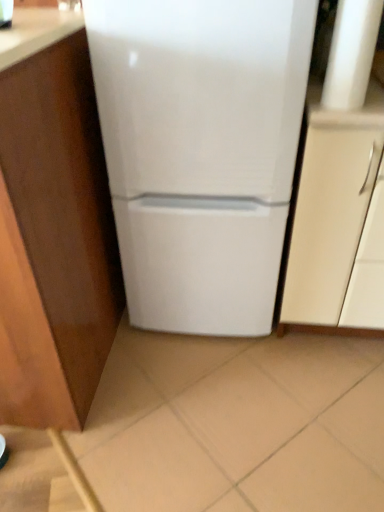
What is the approximate height of matte white cabinet at right, which appears as the 2th cabinetry when viewed from the left?

matte white cabinet at right, which appears as the 2th cabinetry when viewed from the left, is 33.49 inches in height.

At what (x,y) coordinates should I click in order to perform the action: click on white glossy refrigerator at center. Please return your answer as a coordinate pair (x, y). Looking at the image, I should click on (200, 152).

Identify the location of matte white cabinet at right, which appears as the 2th cabinetry when viewed from the left. (328, 212).

Which of these two, wooden cabinet at left, the first cabinetry viewed from the left, or matte white cabinet at right, positioned as the first cabinetry in right-to-left order, stands shorter?

matte white cabinet at right, positioned as the first cabinetry in right-to-left order, is shorter.

Considering the sizes of objects wooden cabinet at left, positioned as the second cabinetry in right-to-left order, and matte white cabinet at right, which appears as the 2th cabinetry when viewed from the left, in the image provided, who is thinner, wooden cabinet at left, positioned as the second cabinetry in right-to-left order, or matte white cabinet at right, which appears as the 2th cabinetry when viewed from the left,?

wooden cabinet at left, positioned as the second cabinetry in right-to-left order.

What's the angular difference between wooden cabinet at left, the first cabinetry viewed from the left, and matte white cabinet at right, positioned as the first cabinetry in right-to-left order,'s facing directions?

The angular difference between wooden cabinet at left, the first cabinetry viewed from the left, and matte white cabinet at right, positioned as the first cabinetry in right-to-left order, is 90 degrees.

From the image's perspective, which one is positioned lower, wooden cabinet at left, positioned as the second cabinetry in right-to-left order, or matte white cabinet at right, positioned as the first cabinetry in right-to-left order?

wooden cabinet at left, positioned as the second cabinetry in right-to-left order, is shown below in the image.

Which is nearer, (x=120, y=224) or (x=52, y=46)?

Point (x=120, y=224).

Is white glossy refrigerator at center oriented away from wooden cabinet at left, positioned as the second cabinetry in right-to-left order?

No, white glossy refrigerator at center's orientation is not away from wooden cabinet at left, positioned as the second cabinetry in right-to-left order.

Does white glossy refrigerator at center appear on the left side of wooden cabinet at left, the first cabinetry viewed from the left?

No.

Is white glossy refrigerator at center thinner than wooden cabinet at left, the first cabinetry viewed from the left?

Incorrect, the width of white glossy refrigerator at center is not less than that of wooden cabinet at left, the first cabinetry viewed from the left.

In the image, is white glossy refrigerator at center on the left side or the right side of matte white cabinet at right, which appears as the 2th cabinetry when viewed from the left?

Based on their positions, white glossy refrigerator at center is located to the left of matte white cabinet at right, which appears as the 2th cabinetry when viewed from the left.

Is white glossy refrigerator at center positioned far away from matte white cabinet at right, positioned as the first cabinetry in right-to-left order?

No, there isn't a large distance between white glossy refrigerator at center and matte white cabinet at right, positioned as the first cabinetry in right-to-left order.

Can you confirm if white glossy refrigerator at center is smaller than matte white cabinet at right, which appears as the 2th cabinetry when viewed from the left?

Indeed, white glossy refrigerator at center has a smaller size compared to matte white cabinet at right, which appears as the 2th cabinetry when viewed from the left.

Is white glossy refrigerator at center oriented towards matte white cabinet at right, which appears as the 2th cabinetry when viewed from the left?

No.

Is matte white cabinet at right, positioned as the first cabinetry in right-to-left order, bigger than white glossy refrigerator at center?

Correct, matte white cabinet at right, positioned as the first cabinetry in right-to-left order, is larger in size than white glossy refrigerator at center.

Does matte white cabinet at right, positioned as the first cabinetry in right-to-left order, appear on the left side of white glossy refrigerator at center?

Incorrect, matte white cabinet at right, positioned as the first cabinetry in right-to-left order, is not on the left side of white glossy refrigerator at center.

Considering the sizes of objects matte white cabinet at right, which appears as the 2th cabinetry when viewed from the left, and white glossy refrigerator at center in the image provided, who is shorter, matte white cabinet at right, which appears as the 2th cabinetry when viewed from the left, or white glossy refrigerator at center?

matte white cabinet at right, which appears as the 2th cabinetry when viewed from the left, is shorter.

From a real-world perspective, starting from the white glossy refrigerator at center, which cabinetry is the 1st one below it? Please provide its 2D coordinates.

[(54, 240)]

Can you tell me how much wooden cabinet at left, the first cabinetry viewed from the left, and white glossy refrigerator at center differ in facing direction?

There is a 90.7-degree angle between the facing directions of wooden cabinet at left, the first cabinetry viewed from the left, and white glossy refrigerator at center.

Are wooden cabinet at left, positioned as the second cabinetry in right-to-left order, and white glossy refrigerator at center located far from each other?

wooden cabinet at left, positioned as the second cabinetry in right-to-left order, is actually quite close to white glossy refrigerator at center.

In the image, is matte white cabinet at right, positioned as the first cabinetry in right-to-left order, on the left side or the right side of wooden cabinet at left, positioned as the second cabinetry in right-to-left order?

In the image, matte white cabinet at right, positioned as the first cabinetry in right-to-left order, appears on the right side of wooden cabinet at left, positioned as the second cabinetry in right-to-left order.

Considering the sizes of objects matte white cabinet at right, which appears as the 2th cabinetry when viewed from the left, and wooden cabinet at left, positioned as the second cabinetry in right-to-left order, in the image provided, who is thinner, matte white cabinet at right, which appears as the 2th cabinetry when viewed from the left, or wooden cabinet at left, positioned as the second cabinetry in right-to-left order,?

With smaller width is wooden cabinet at left, positioned as the second cabinetry in right-to-left order.

Considering the sizes of matte white cabinet at right, which appears as the 2th cabinetry when viewed from the left, and wooden cabinet at left, the first cabinetry viewed from the left, in the image, is matte white cabinet at right, which appears as the 2th cabinetry when viewed from the left, taller or shorter than wooden cabinet at left, the first cabinetry viewed from the left,?

Considering their sizes, matte white cabinet at right, which appears as the 2th cabinetry when viewed from the left, has less height than wooden cabinet at left, the first cabinetry viewed from the left.

Is there a large distance between matte white cabinet at right, positioned as the first cabinetry in right-to-left order, and wooden cabinet at left, the first cabinetry viewed from the left?

matte white cabinet at right, positioned as the first cabinetry in right-to-left order, is actually quite close to wooden cabinet at left, the first cabinetry viewed from the left.

This screenshot has width=384, height=512. Identify the location of cabinetry lying on the left of matte white cabinet at right, which appears as the 2th cabinetry when viewed from the left. (54, 240).

Image resolution: width=384 pixels, height=512 pixels. Find the location of `cabinetry that is the 1st object directly below the white glossy refrigerator at center (from a real-world perspective)`. cabinetry that is the 1st object directly below the white glossy refrigerator at center (from a real-world perspective) is located at coordinates (54, 240).

Estimate the real-world distances between objects in this image. Which object is further from wooden cabinet at left, the first cabinetry viewed from the left, matte white cabinet at right, which appears as the 2th cabinetry when viewed from the left, or white glossy refrigerator at center?

matte white cabinet at right, which appears as the 2th cabinetry when viewed from the left.

Which object lies further to the anchor point white glossy refrigerator at center, wooden cabinet at left, the first cabinetry viewed from the left, or matte white cabinet at right, positioned as the first cabinetry in right-to-left order?

wooden cabinet at left, the first cabinetry viewed from the left, is positioned further to the anchor white glossy refrigerator at center.

From the image, which object appears to be nearer to matte white cabinet at right, which appears as the 2th cabinetry when viewed from the left, wooden cabinet at left, the first cabinetry viewed from the left, or white glossy refrigerator at center?

white glossy refrigerator at center is positioned closer to the anchor matte white cabinet at right, which appears as the 2th cabinetry when viewed from the left.

When comparing their distances from white glossy refrigerator at center, does matte white cabinet at right, positioned as the first cabinetry in right-to-left order, or wooden cabinet at left, positioned as the second cabinetry in right-to-left order, seem closer?

Based on the image, matte white cabinet at right, positioned as the first cabinetry in right-to-left order, appears to be nearer to white glossy refrigerator at center.

Considering their positions, is white glossy refrigerator at center positioned further to matte white cabinet at right, positioned as the first cabinetry in right-to-left order, than wooden cabinet at left, positioned as the second cabinetry in right-to-left order?

Among the two, wooden cabinet at left, positioned as the second cabinetry in right-to-left order, is located further to matte white cabinet at right, positioned as the first cabinetry in right-to-left order.

Looking at the image, which one is located closer to wooden cabinet at left, the first cabinetry viewed from the left, white glossy refrigerator at center or matte white cabinet at right, which appears as the 2th cabinetry when viewed from the left?

white glossy refrigerator at center lies closer to wooden cabinet at left, the first cabinetry viewed from the left, than the other object.

At what (x,y) coordinates should I click in order to perform the action: click on refrigerator between wooden cabinet at left, the first cabinetry viewed from the left, and matte white cabinet at right, positioned as the first cabinetry in right-to-left order, from left to right. Please return your answer as a coordinate pair (x, y). Image resolution: width=384 pixels, height=512 pixels. Looking at the image, I should click on (200, 152).